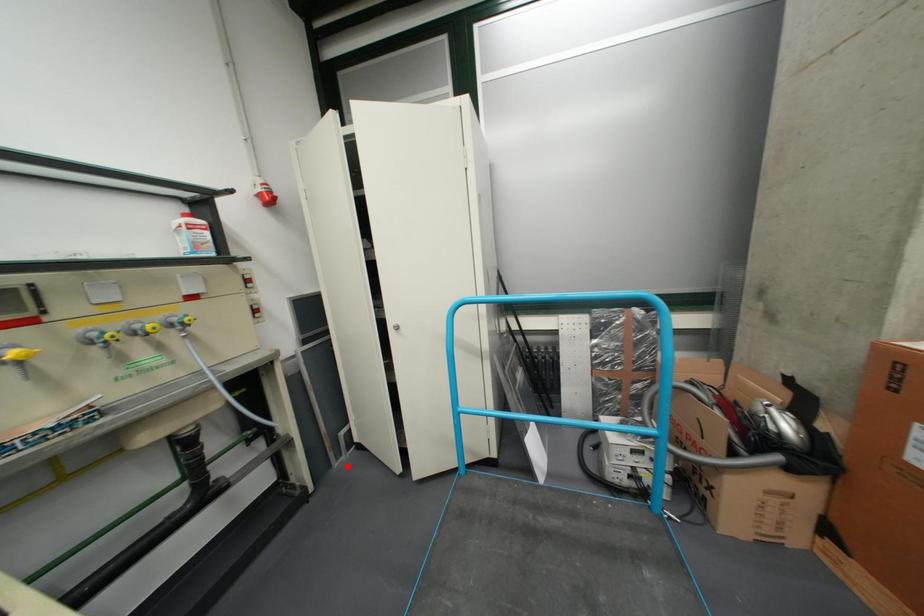
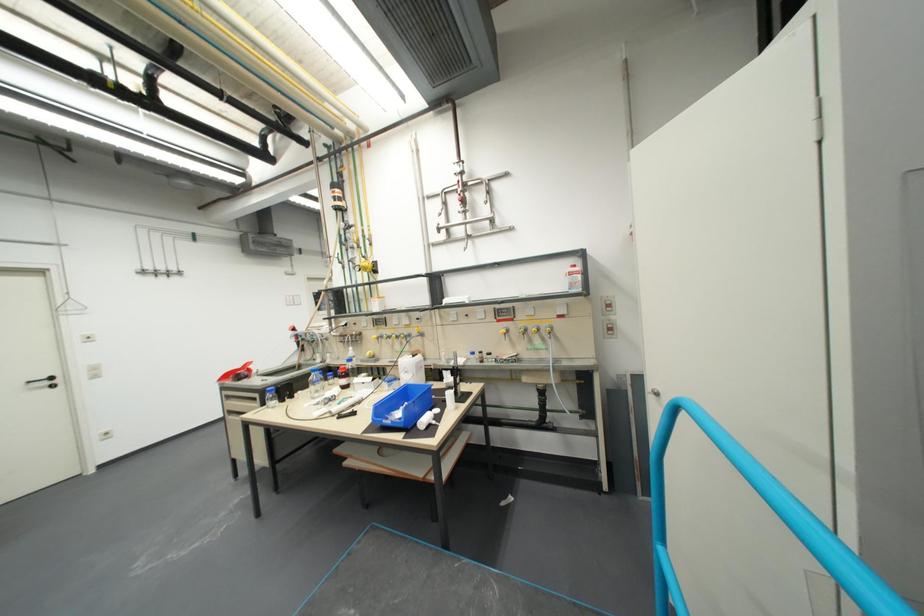
Locate, in the second image, the point that corresponds to the highlighted location in the first image.

(652, 498)